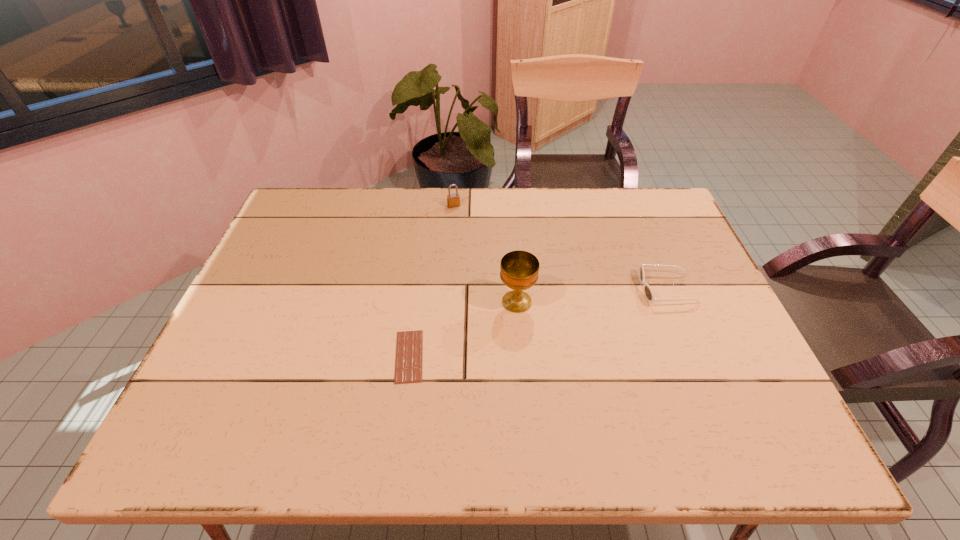
The width and height of the screenshot is (960, 540). Identify the location of the second object from right to left. (519, 269).

Locate an element on the screen. the tallest object is located at coordinates (519, 269).

Identify the location of the farthest object. This screenshot has height=540, width=960. (453, 200).

Where is `the third object from right to left`? Image resolution: width=960 pixels, height=540 pixels. the third object from right to left is located at coordinates (453, 200).

The width and height of the screenshot is (960, 540). In order to click on the rightmost object in this screenshot , I will do `click(648, 292)`.

Locate an element on the screen. the second shortest object is located at coordinates (648, 292).

This screenshot has height=540, width=960. What are the coordinates of `the leftmost object` in the screenshot? It's located at (409, 348).

Identify the location of the nearest object. (409, 348).

The image size is (960, 540). I want to click on vacant space located on the back of the tallest object, so click(x=510, y=210).

Image resolution: width=960 pixels, height=540 pixels. I want to click on vacant position located 0.340m on the right of the padlock, so tap(565, 206).